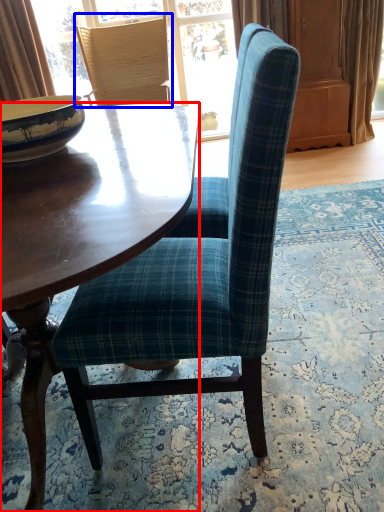
Question: Which object is further to the camera taking this photo, coffee table (highlighted by a red box) or chair (highlighted by a blue box)?

Choices:
 (A) coffee table
 (B) chair

Answer: (B)